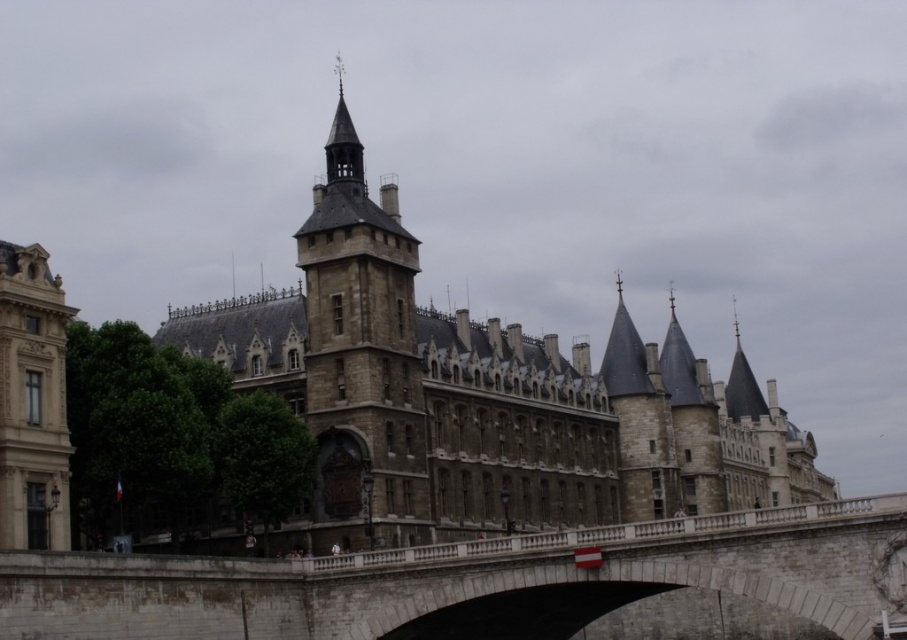
Question: Does stone bridge at center have a lesser width compared to brown stone tower at center?

Choices:
 (A) yes
 (B) no

Answer: (B)

Question: Is stone castle at center bigger than brown stone tower at center?

Choices:
 (A) no
 (B) yes

Answer: (B)

Question: Is stone castle at center smaller than stone tower at left?

Choices:
 (A) yes
 (B) no

Answer: (B)

Question: Which object is farther from the camera taking this photo?

Choices:
 (A) stone tower at left
 (B) stone bridge at center
 (C) stone castle at center

Answer: (C)

Question: Based on their relative distances, which object is farther from the brown stone tower at center?

Choices:
 (A) stone bridge at center
 (B) stone castle at center

Answer: (B)

Question: Which point is closer to the camera?

Choices:
 (A) (340, 307)
 (B) (450, 582)

Answer: (B)